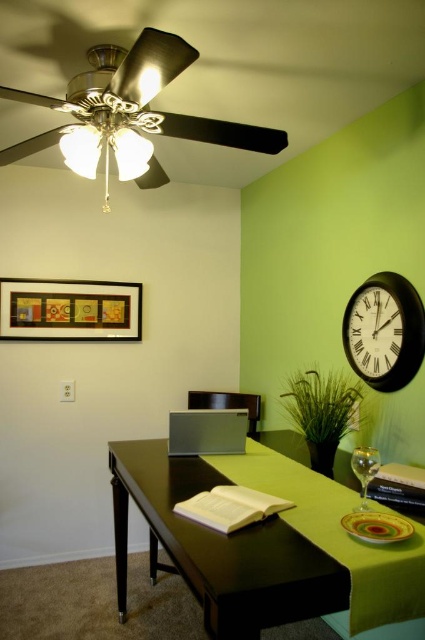
Is metallic gray laptop at center below transparent glass wine glass at center?

No.

Is metallic gray laptop at center thinner than transparent glass wine glass at center?

No, metallic gray laptop at center is not thinner than transparent glass wine glass at center.

Is point (181, 413) positioned in front of point (359, 467)?

No.

You are a GUI agent. You are given a task and a screenshot of the screen. Output one action in this format:
    pyautogui.click(x=<x>, y=<y>)
    Task: Click on the metallic gray laptop at center
    The width and height of the screenshot is (425, 640).
    Given the screenshot: What is the action you would take?
    (206, 432)

Between metallic gray laptop at center and matte black chair at center, which one appears on the right side from the viewer's perspective?

Positioned to the right is matte black chair at center.

Can you confirm if metallic gray laptop at center is bigger than matte black chair at center?

Actually, metallic gray laptop at center might be smaller than matte black chair at center.

Where is `metallic gray laptop at center`? Image resolution: width=425 pixels, height=640 pixels. metallic gray laptop at center is located at coordinates (206, 432).

Where is `metallic gray laptop at center`? metallic gray laptop at center is located at coordinates [x=206, y=432].

Between matte black picture frame at upper left and matte black chair at center, which one is positioned lower?

matte black chair at center is lower down.

Is matte black picture frame at upper left taller than matte black chair at center?

Indeed, matte black picture frame at upper left has a greater height compared to matte black chair at center.

Locate an element on the screen. The width and height of the screenshot is (425, 640). matte black picture frame at upper left is located at coordinates (70, 310).